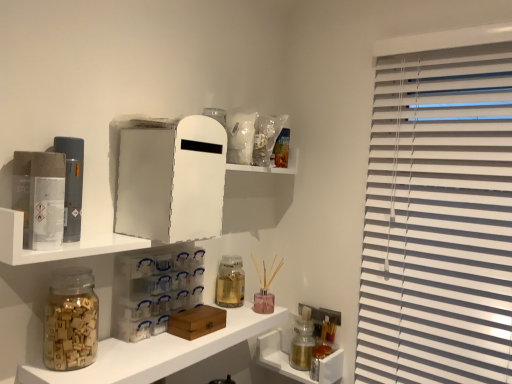
Question: Considering the positions of point (261, 360) and point (124, 205), is point (261, 360) closer or farther from the camera than point (124, 205)?

Choices:
 (A) farther
 (B) closer

Answer: (A)

Question: From the image's perspective, is metallic silver canisters at lower right, which is counted as the second cabinet, starting from the top, above or below white matte medicine cabinet at upper center?

Choices:
 (A) below
 (B) above

Answer: (A)

Question: Which of these objects is positioned farthest from the translucent glass jar at center, which ranks as the second bottle in back-to-front order?

Choices:
 (A) transparent plastic drawers at center, which is the second cabinet from back to front
 (B) translucent glass bottle at lower right, which is the 2th bottle from top to bottom
 (C) metallic silver canisters at lower right, which is counted as the 1th cabinet, starting from the back
 (D) transparent glass jar at lower left
 (E) white plastic shelf at upper left, which is the second shelf in bottom-to-top order

Answer: (E)

Question: Based on their relative distances, which object is nearer to the translucent glass jar at lower left, the 2th shelf when ordered from top to bottom?

Choices:
 (A) translucent glass jar at center, which is the 1th bottle in top-to-bottom order
 (B) translucent glass bottle at lower right, which is the first bottle in back-to-front order
 (C) white matte medicine cabinet at upper center
 (D) transparent glass jar at lower left
 (E) transparent plastic drawers at center, positioned as the second cabinet in bottom-to-top order

Answer: (E)